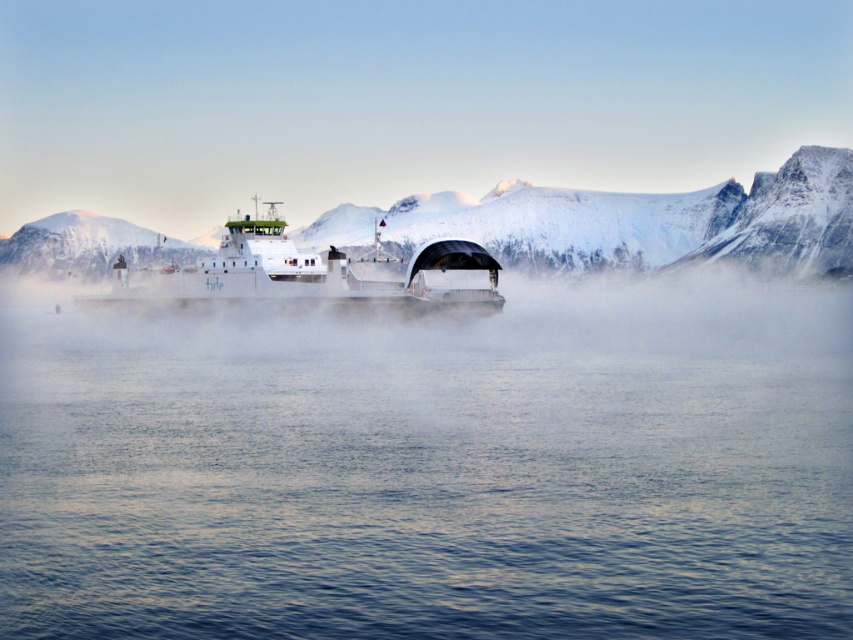
Question: Does clear water at center appear over white matte ferry at center?

Choices:
 (A) no
 (B) yes

Answer: (A)

Question: Can you confirm if clear water at center is wider than white snow-covered mountain at upper left?

Choices:
 (A) yes
 (B) no

Answer: (A)

Question: Which of the following is the closest to the observer?

Choices:
 (A) white snow-covered mountain at upper left
 (B) clear water at center

Answer: (B)

Question: Can you confirm if white matte ferry at center is bigger than white snow-covered mountain at upper left?

Choices:
 (A) yes
 (B) no

Answer: (B)

Question: Which of the following is the closest to the observer?

Choices:
 (A) clear water at center
 (B) white snow-covered mountain at upper left

Answer: (A)

Question: Which object is positioned farthest from the clear water at center?

Choices:
 (A) white snow-covered mountain at upper left
 (B) white matte ferry at center

Answer: (A)